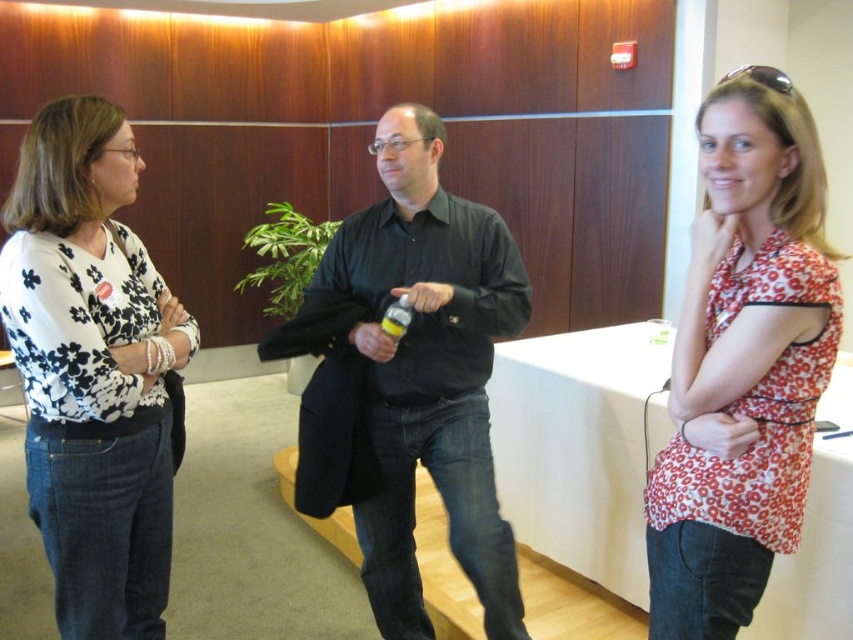
You are a photographer setting up a shoot in this scene. You need to ensure that the floral fabric blouse at right and the yellow matte bottle at center are both visible in the frame. Given their height difference, which object should you position closer to the camera to maintain both in focus?

The floral fabric blouse at right is much taller than the yellow matte bottle at center. To maintain both in focus, position the shorter yellow matte bottle at center closer to the camera so that its height aligns more closely with the blouse, ensuring depth of field covers both effectively.

You are a photographer setting up a shoot in this scene. You need to ensure that both the black matte shirt at center and the floral fabric blouse at right are visible in the frame. Given their heights, which clothing item might require you to adjust your camera angle to avoid being obscured?

The black matte shirt at center is much taller than the floral fabric blouse at right, so the camera angle might need to be lowered to ensure the floral fabric blouse at right isn not blocked by the taller black matte shirt at center.

From the picture: You are a photographer setting up a shot of the scene. The floral fabric blouse at right and the yellow matte bottle at center are both in the frame. Which object is positioned lower in the image?

The floral fabric blouse at right is below the yellow matte bottle at center, so it is positioned lower in the image.